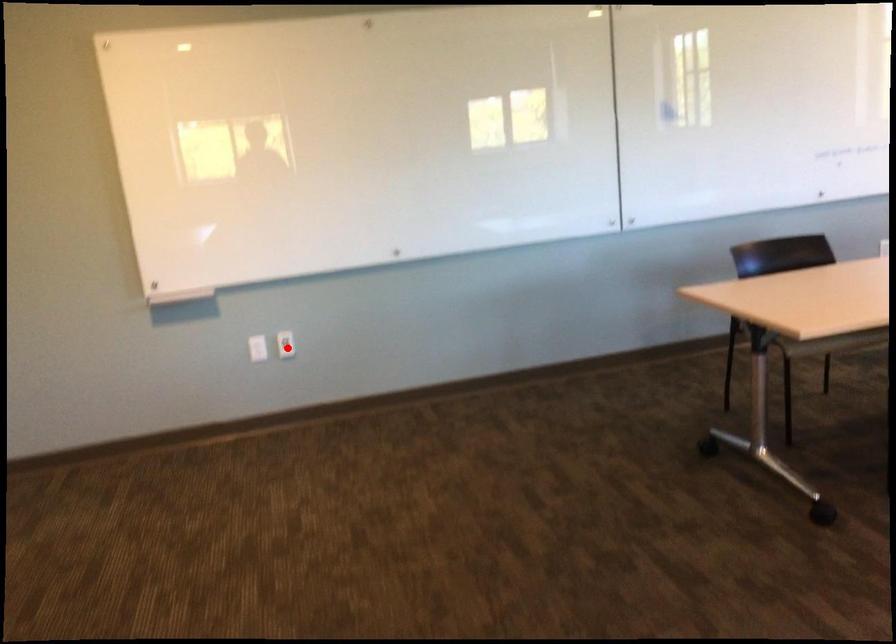
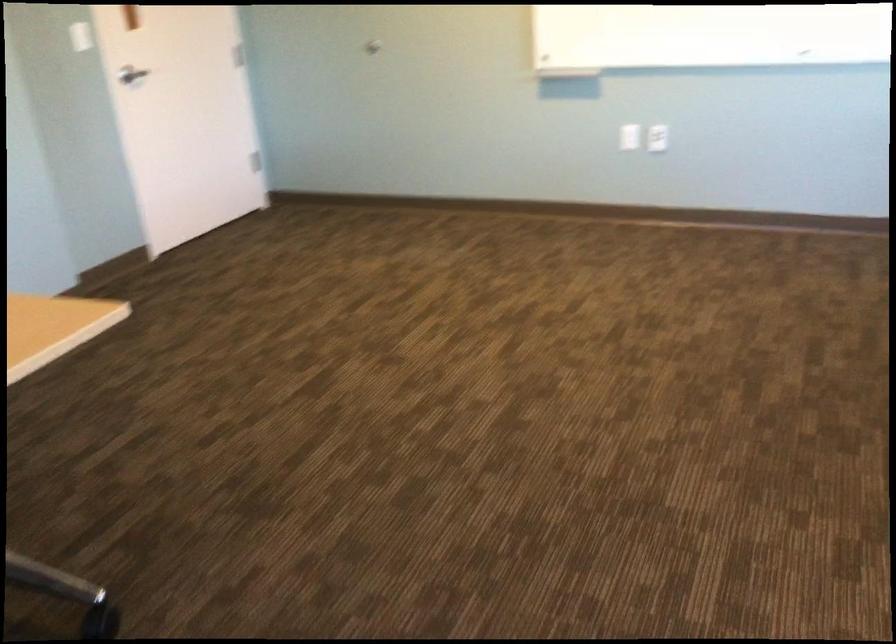
Where in the second image is the point corresponding to the highlighted location from the first image?

(657, 138)